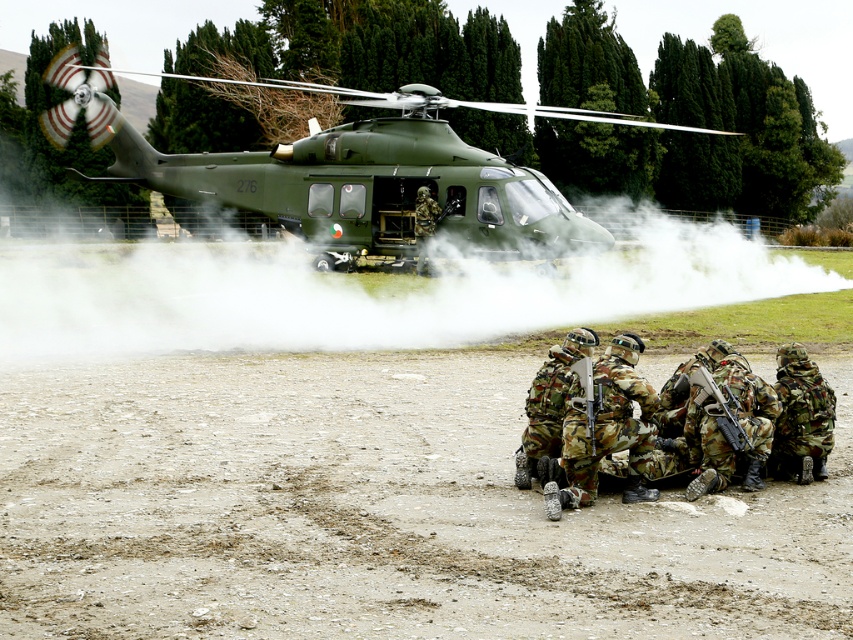
From the picture: You are a soldier in the military training scenario. You need to retrieve both the camouflage fabric rifle at center and the matte black rifle at center. Which rifle should you pick up first if you want to reach the one that is lower in position?

The camouflage fabric rifle at center is below the matte black rifle at center, so you should pick up the camouflage fabric rifle at center first since it is lower and requires bending down before reaching the higher one.

You are a soldier in the military training scenario. You need to retrieve your rifle which is at point [724,417]. The helicopter is at point 0.3, 0.2. Can you safely move from the helicopter to retrieve your rifle without exposing yourself to the open field?

The camouflage fabric rifle at center is located at point [724,417]. Since the helicopter is at point 0.3, 0.2, you can move from the helicopter to the rifle without crossing open field as they are positioned in the same area.